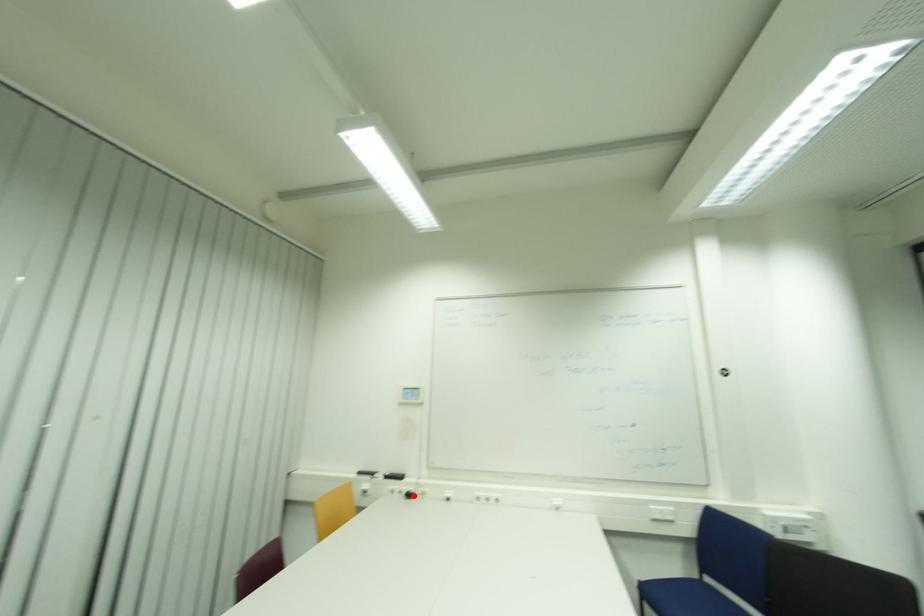
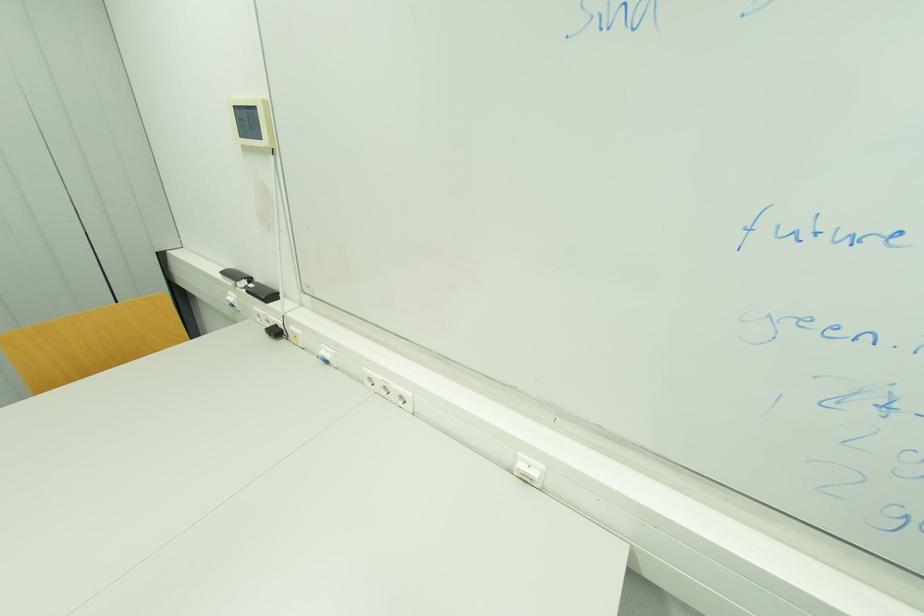
Question: I am providing you with two images of the same scene from different viewpoints. In image1, a red point is highlighted. Considering the same 3D point in image2, which of the following is correct?

Choices:
 (A) It is closer
 (B) It is farther

Answer: (A)